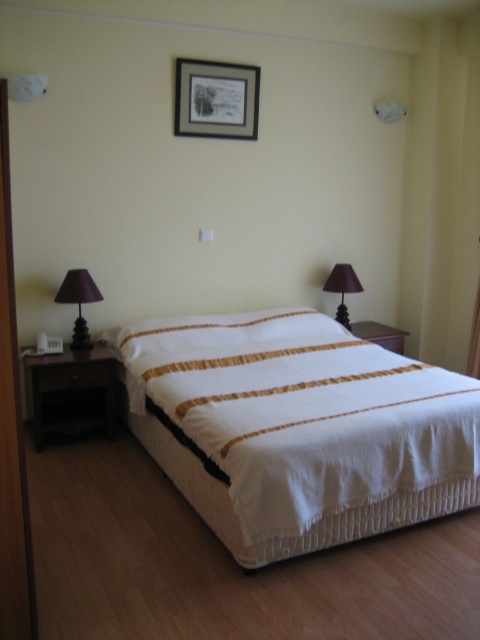
You are standing in the bedroom and want to place a new clock on the wall between the black wood picture frame at upper center and the matte purple fabric lampshade at left. Which object should you move to make space?

The black wood picture frame at upper center is closer to you, so you should move it to make space for the new clock.

You are standing in the bedroom and want to place a new picture frame exactly where the black wood picture frame at upper center is currently located. What are the coordinates of the spot where you should place the new picture frame?

The coordinates for the black wood picture frame at upper center are at point (216, 99).